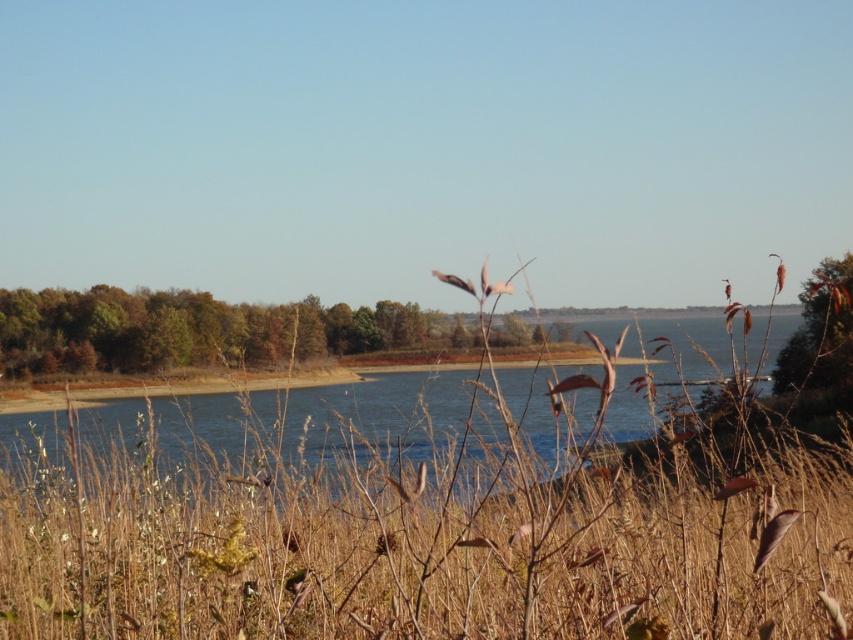
Is brown dry grass at center above brown matte branch at upper right?

Incorrect, brown dry grass at center is not positioned above brown matte branch at upper right.

Can you confirm if brown dry grass at center is thinner than brown matte branch at upper right?

Incorrect, brown dry grass at center's width is not less than brown matte branch at upper right's.

Identify the location of brown dry grass at center. (413, 522).

At what (x,y) coordinates should I click in order to perform the action: click on brown dry grass at center. Please return your answer as a coordinate pair (x, y). Image resolution: width=853 pixels, height=640 pixels. Looking at the image, I should click on (413, 522).